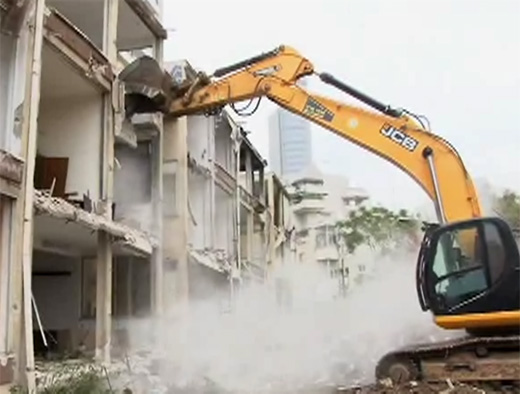
Image resolution: width=520 pixels, height=394 pixels. What are the coordinates of `wall` in the screenshot? It's located at (45, 134).